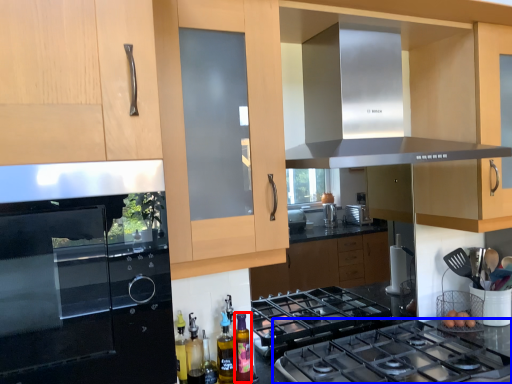
Question: Which object appears farthest to the camera in this image, bottle (highlighted by a red box) or gas stove (highlighted by a blue box)?

Choices:
 (A) bottle
 (B) gas stove

Answer: (A)